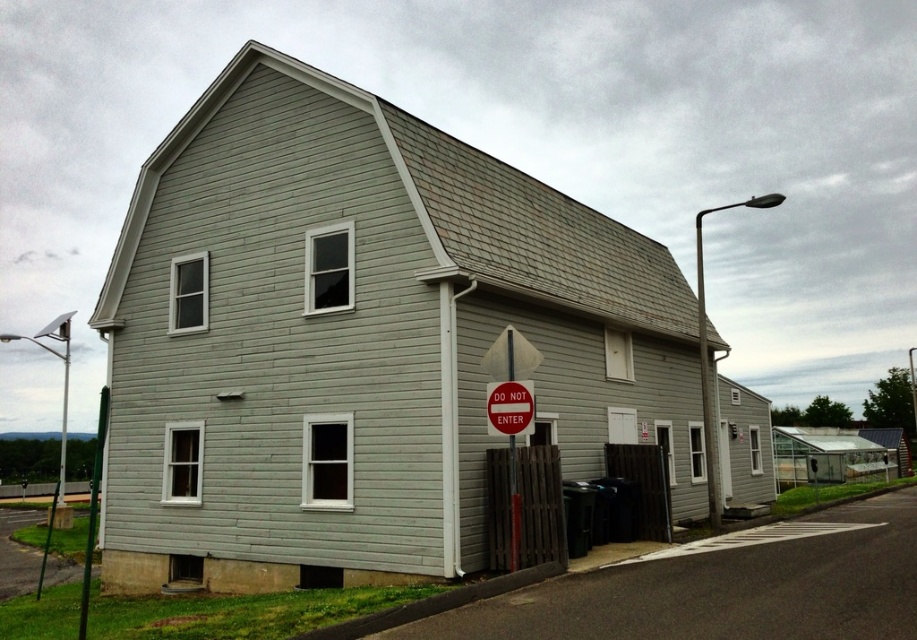
Can you confirm if red plastic sign at center is taller than metallic pole at left?

No.

Between red plastic sign at center and metallic pole at left, which one is positioned lower?

Positioned lower is metallic pole at left.

Who is more forward, (492, 413) or (64, 346)?

Positioned in front is point (492, 413).

Where is `red plastic sign at center`? Image resolution: width=917 pixels, height=640 pixels. red plastic sign at center is located at coordinates (509, 406).

Who is higher up, red plastic sign at lower center or metallic pole at left?

red plastic sign at lower center is higher up.

Does red plastic sign at lower center appear on the right side of metallic pole at left?

Indeed, red plastic sign at lower center is positioned on the right side of metallic pole at left.

This screenshot has height=640, width=917. Identify the location of red plastic sign at lower center. (511, 410).

Does smooth gray siding at center have a lesser height compared to red plastic sign at center?

No, smooth gray siding at center is not shorter than red plastic sign at center.

Describe the element at coordinates (361, 340) in the screenshot. I see `smooth gray siding at center` at that location.

Where is `smooth gray siding at center`? The image size is (917, 640). smooth gray siding at center is located at coordinates (361, 340).